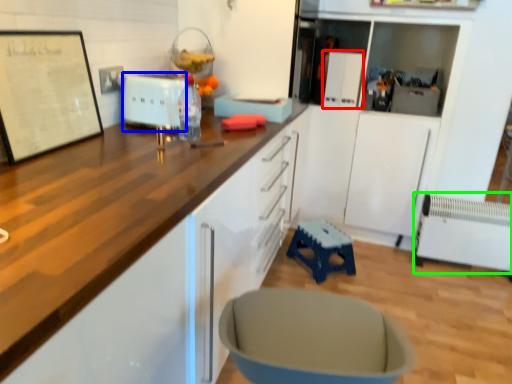
Question: Which object is the farthest from appliance (highlighted by a red box)? Choose among these: appliance (highlighted by a blue box) or radiator (highlighted by a green box).

Choices:
 (A) appliance
 (B) radiator

Answer: (A)